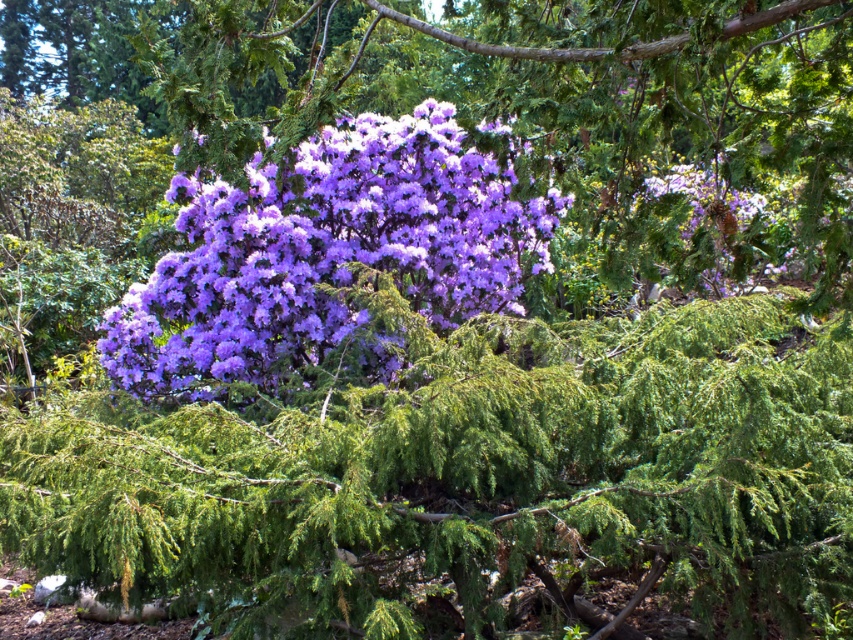
In the scene shown: Is purple matte bush at center bigger than purple matte flower at center?

Correct, purple matte bush at center is larger in size than purple matte flower at center.

Is purple matte bush at center thinner than purple matte flower at center?

No.

Is point (347, 33) positioned after point (450, 230)?

Yes, point (347, 33) is behind point (450, 230).

Find the location of `purple matte bush at center`. purple matte bush at center is located at coordinates (567, 113).